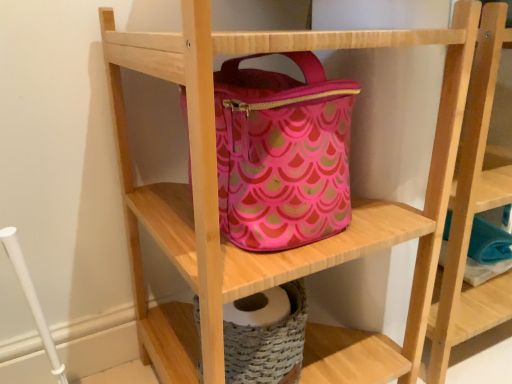
The width and height of the screenshot is (512, 384). Describe the element at coordinates (282, 154) in the screenshot. I see `pink fabric handbag at center` at that location.

Where is `pink fabric handbag at center`? The image size is (512, 384). pink fabric handbag at center is located at coordinates (282, 154).

Image resolution: width=512 pixels, height=384 pixels. Find the location of `pink fabric handbag at center`. pink fabric handbag at center is located at coordinates (282, 154).